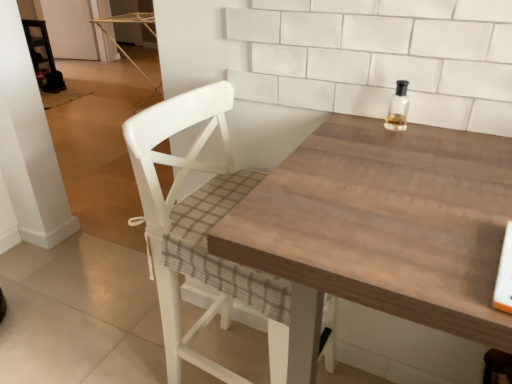
The height and width of the screenshot is (384, 512). Identify the location of empty space that is ontop of wooden table at center (from a real-world perspective). (397, 200).